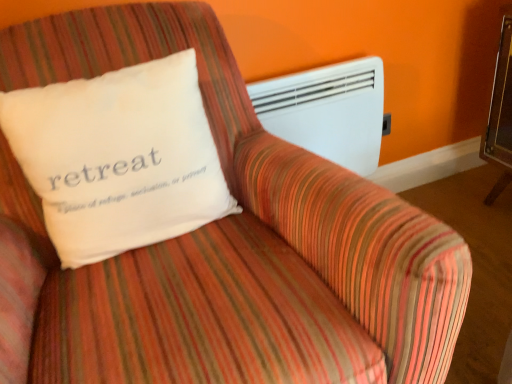
Question: From the image's perspective, is white plastic heater at upper right positioned above or below white soft pillow at upper left?

Choices:
 (A) above
 (B) below

Answer: (A)

Question: From a real-world perspective, is white plastic heater at upper right above or below white soft pillow at upper left?

Choices:
 (A) above
 (B) below

Answer: (B)

Question: Considering the positions of point (365, 64) and point (37, 132), is point (365, 64) closer or farther from the camera than point (37, 132)?

Choices:
 (A) farther
 (B) closer

Answer: (A)

Question: Is white soft pillow at upper left in front of or behind white plastic heater at upper right in the image?

Choices:
 (A) behind
 (B) front

Answer: (B)

Question: Is white soft pillow at upper left situated inside white plastic heater at upper right or outside?

Choices:
 (A) outside
 (B) inside

Answer: (A)

Question: Looking at their shapes, would you say white soft pillow at upper left is wider or thinner than white plastic heater at upper right?

Choices:
 (A) wide
 (B) thin

Answer: (A)

Question: From the image's perspective, relative to white plastic heater at upper right, is white soft pillow at upper left above or below?

Choices:
 (A) below
 (B) above

Answer: (A)